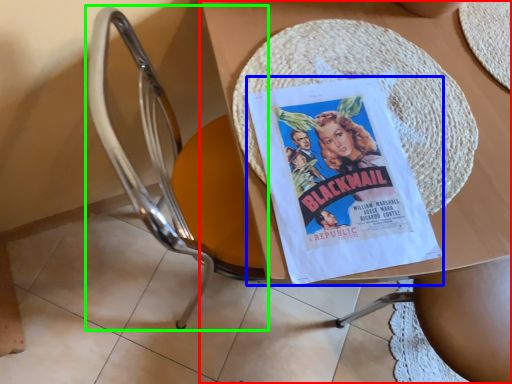
Question: Which is nearer to the table (highlighted by a red box)? comic book (highlighted by a blue box) or chair (highlighted by a green box).

Choices:
 (A) comic book
 (B) chair

Answer: (A)